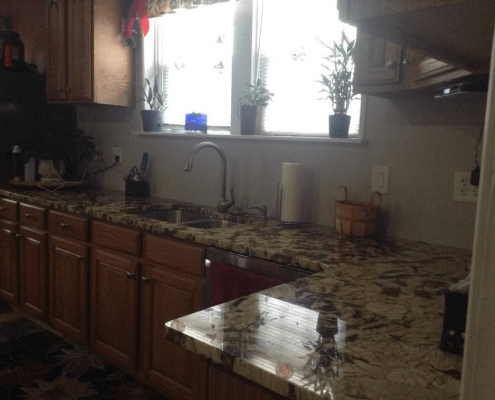
Where is `paper towel roll`? The height and width of the screenshot is (400, 495). paper towel roll is located at coordinates (291, 196).